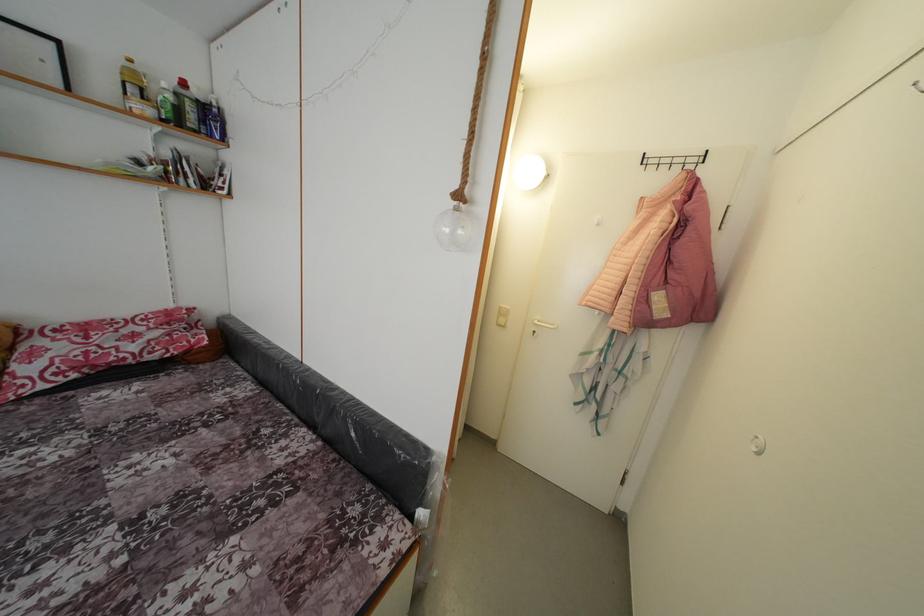
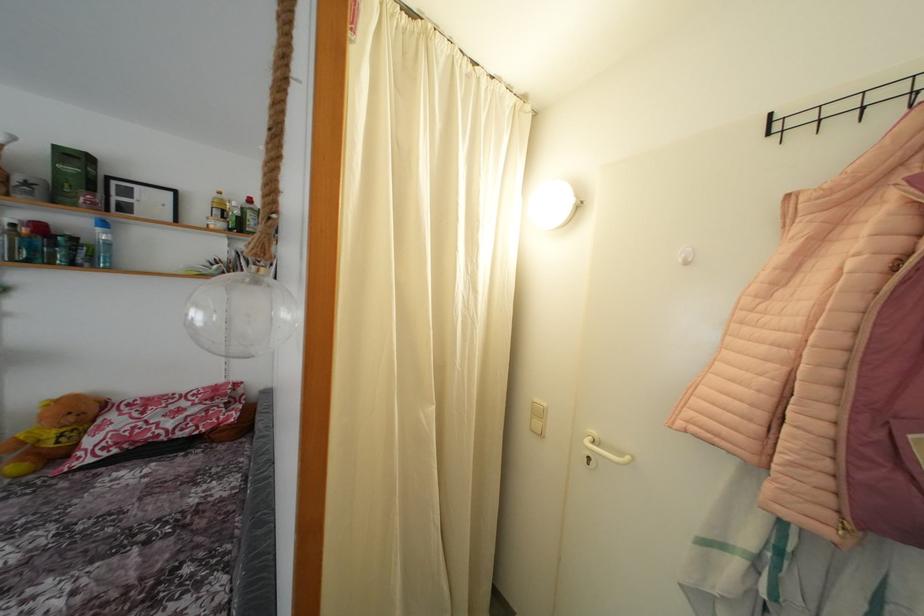
Find the pixel in the second image that matches (x=136, y=67) in the first image.

(225, 199)